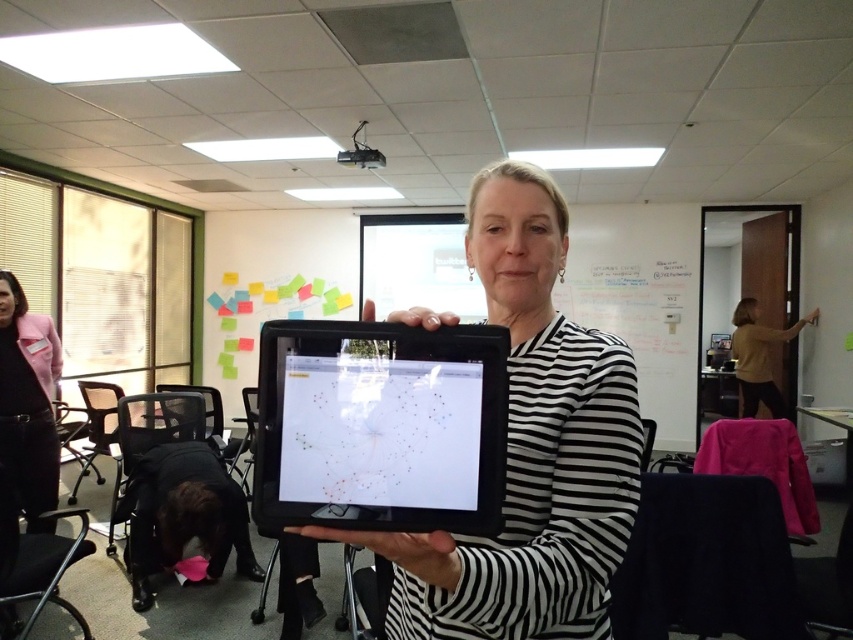
You are organizing a presentation and need to place the black glossy tablet at center and the matte brown sweater at right on a desk. Which object requires a larger space horizontally to fit properly?

The matte brown sweater at right requires a larger horizontal space because its width is greater than the black glossy tablet at center.

You are organizing a presentation and need to choose between the black glossy tablet at center and the black matte tablet at center. Which one is bigger?

The black glossy tablet at center is larger in size compared to the black matte tablet at center.

You are standing in the office and need to place a 20 feet long banner between the black glossy tablet at center and the white matte whiteboard at upper center. Can you fit it without bending the banner?

The distance between the black glossy tablet at center and the white matte whiteboard at upper center is 20.59 feet, which is slightly longer than the 20 feet banner. Therefore, the banner can be placed straight between them without bending.